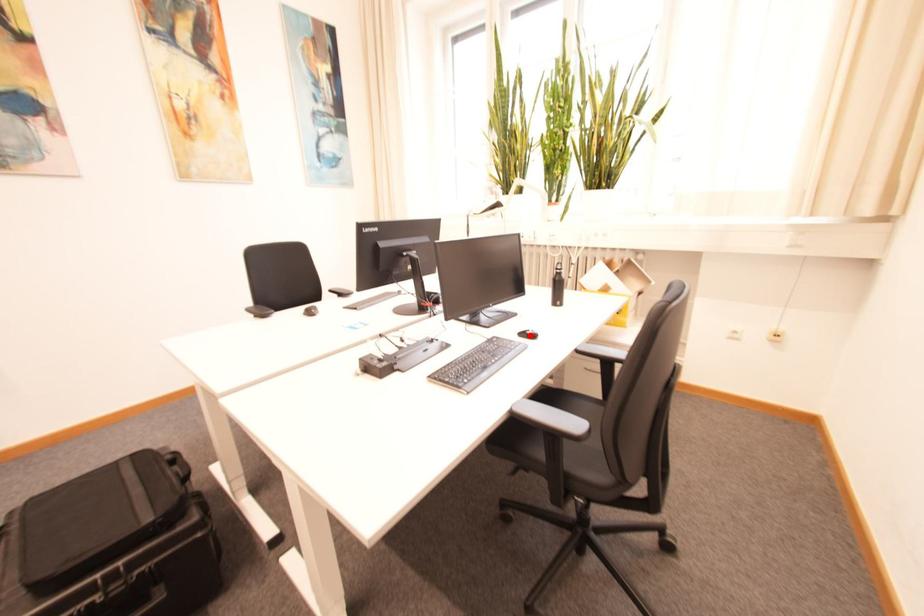
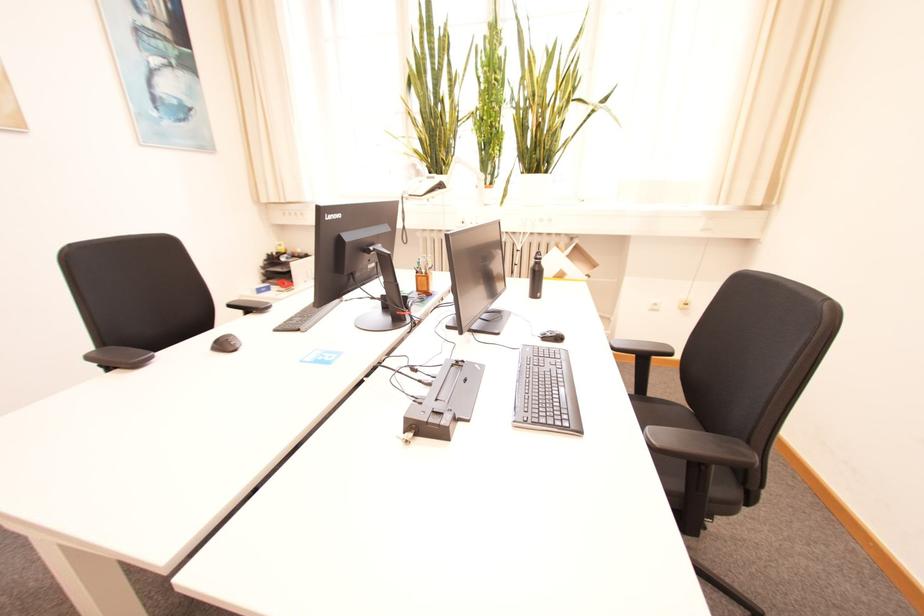
Where in the second image is the point corresponding to the highlighted location from the first image?

(551, 338)